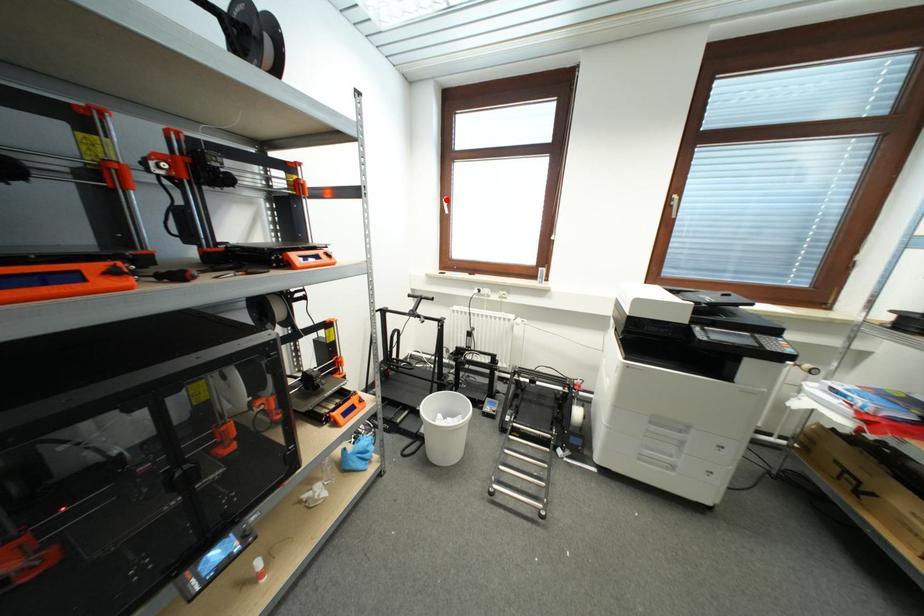
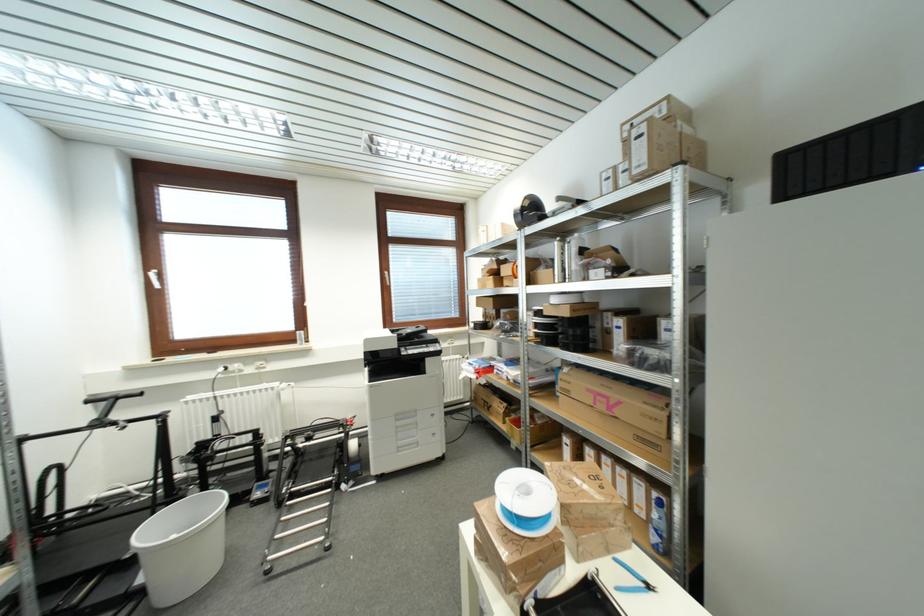
Locate, in the second image, the point that corresponds to the highlighted location in the first image.

(151, 273)